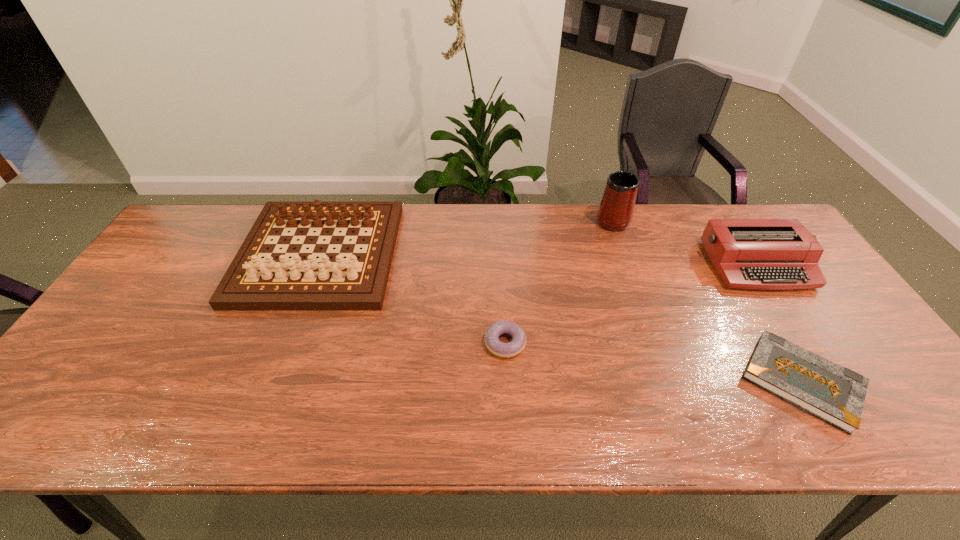
This screenshot has height=540, width=960. What are the coordinates of `the third object from left to right` in the screenshot? It's located at (615, 212).

The width and height of the screenshot is (960, 540). What are the coordinates of `the tallest object` in the screenshot? It's located at (615, 212).

Find the location of `the leftmost object`. the leftmost object is located at coordinates (275, 282).

Locate an element on the screen. The image size is (960, 540). typewriter is located at coordinates (766, 254).

Where is `doughnut`? doughnut is located at coordinates tap(494, 345).

You are a GUI agent. You are given a task and a screenshot of the screen. Output one action in this format:
    pyautogui.click(x=<x>, y=<y>)
    Task: Click on the notebook
    
    Given the screenshot: What is the action you would take?
    tap(830, 392)

You are a GUI agent. You are given a task and a screenshot of the screen. Output one action in this format:
    pyautogui.click(x=<x>, y=<y>)
    Task: Click on the free space located 0.100m on the side with the white pieces of the leftmost object
    The height and width of the screenshot is (540, 960).
    Given the screenshot: What is the action you would take?
    pyautogui.click(x=286, y=341)

Locate an element on the screen. vacant area located 0.290m on the typing side of the typewriter is located at coordinates (834, 384).

Find the location of a particular element. The width and height of the screenshot is (960, 540). vacant point located on the left of the fourth object from right to left is located at coordinates (405, 343).

At what (x,y) coordinates should I click in order to perform the action: click on free spot located on the left of the notebook. Please return your answer as a coordinate pair (x, y). Image resolution: width=960 pixels, height=540 pixels. Looking at the image, I should click on (602, 382).